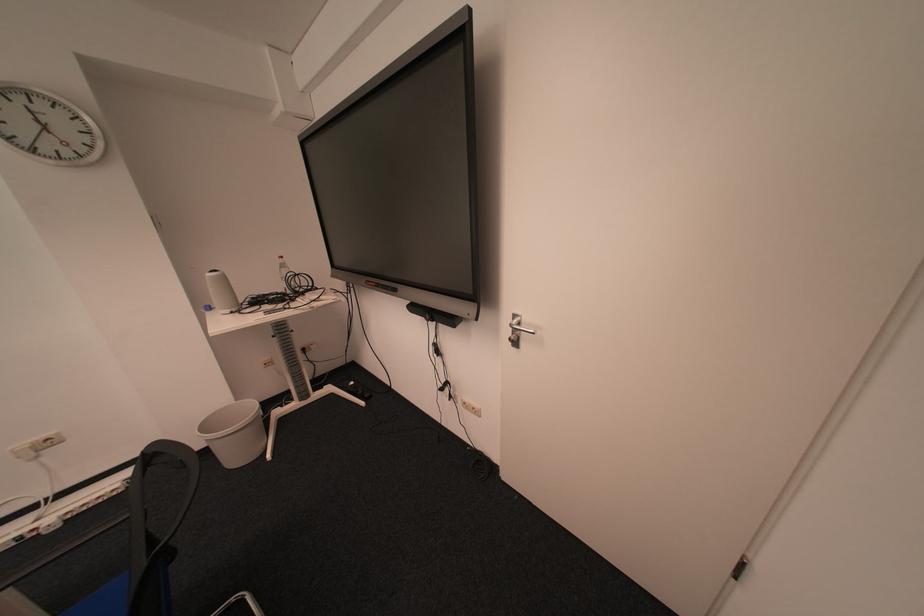
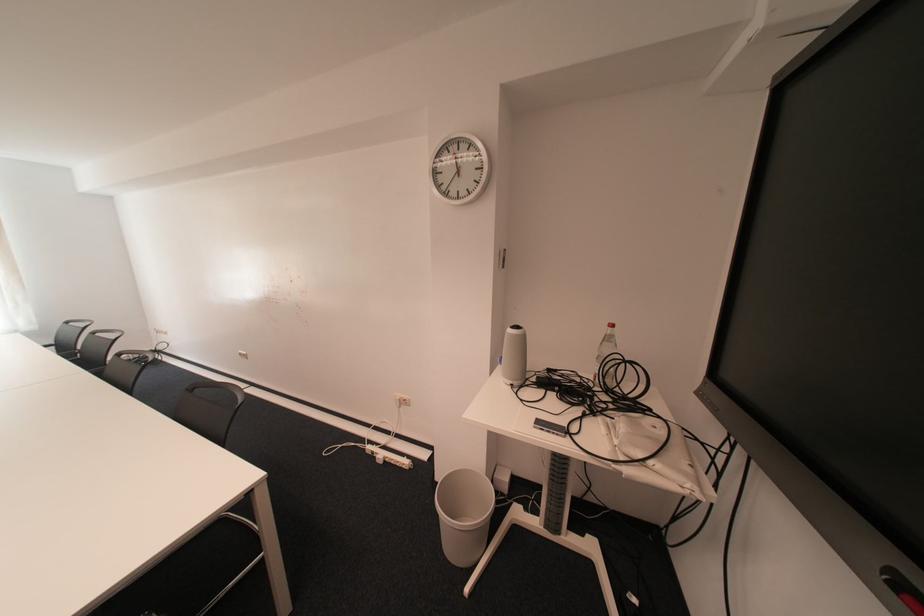
Where in the second image is the point corresponding to (276,315) from the first image?

(545, 428)